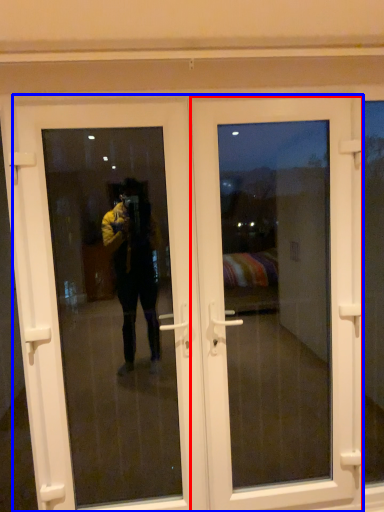
Question: Which of the following is the farthest to the observer, door (highlighted by a red box) or door (highlighted by a blue box)?

Choices:
 (A) door
 (B) door

Answer: (A)